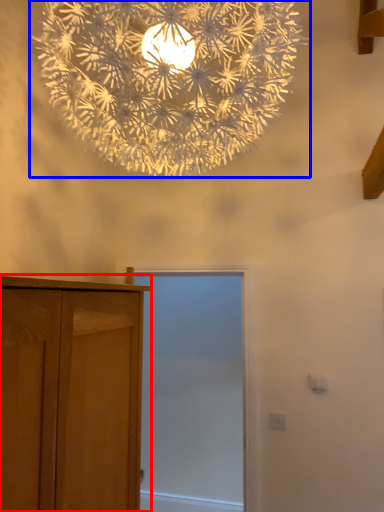
Question: Which object appears farthest to the camera in this image, cupboard (highlighted by a red box) or lamp (highlighted by a blue box)?

Choices:
 (A) cupboard
 (B) lamp

Answer: (B)